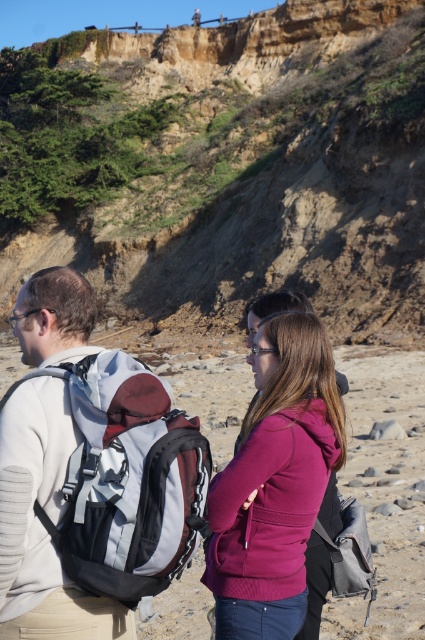
Question: Which of the following is the farthest from the observer?

Choices:
 (A) (405, 564)
 (B) (87, 113)

Answer: (B)

Question: Among these points, which one is nearest to the camera?

Choices:
 (A) (359, 333)
 (B) (257, 632)
 (C) (342, 346)

Answer: (B)

Question: Can you confirm if gray fabric backpack at center is bigger than matte black backpack at center?

Choices:
 (A) no
 (B) yes

Answer: (A)

Question: Does earthy brown cliff at upper center have a larger size compared to purple fleece jacket at center?

Choices:
 (A) no
 (B) yes

Answer: (B)

Question: Which object is the farthest from the purple fleece jacket at center?

Choices:
 (A) gray fabric backpack at center
 (B) matte black backpack at center

Answer: (B)

Question: Is earthy brown cliff at upper center in front of matte black backpack at center?

Choices:
 (A) no
 (B) yes

Answer: (A)